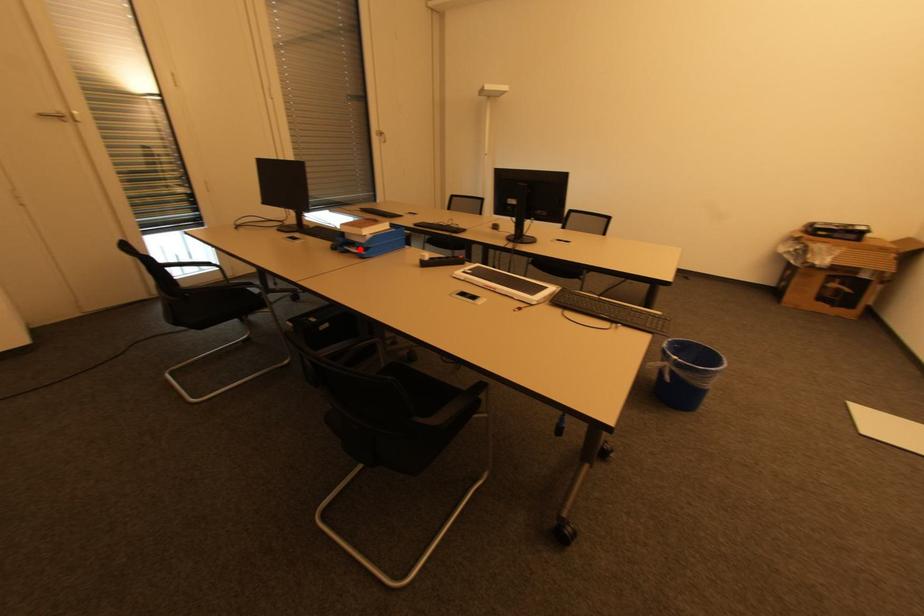
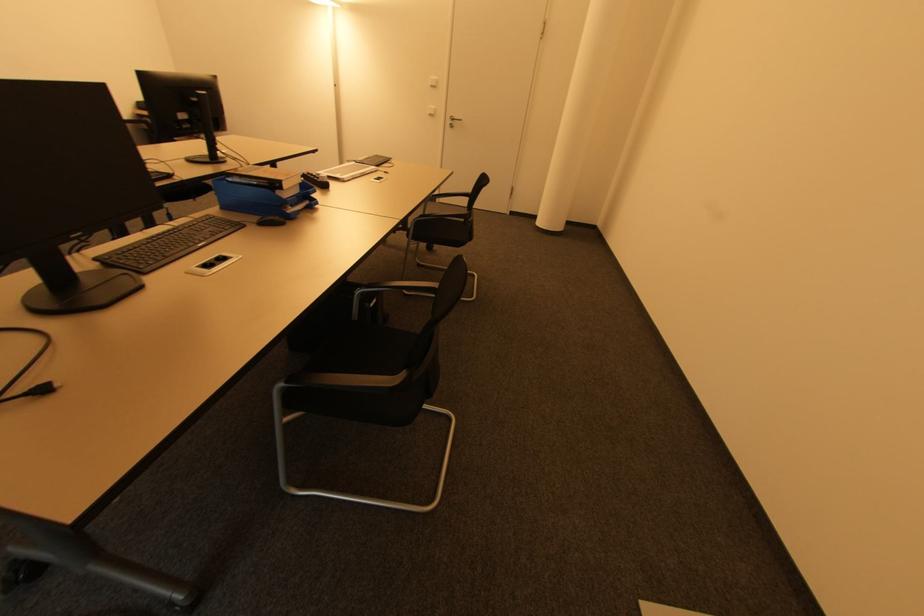
Find the pixel in the second image that matches the highlighted location in the first image.

(294, 207)